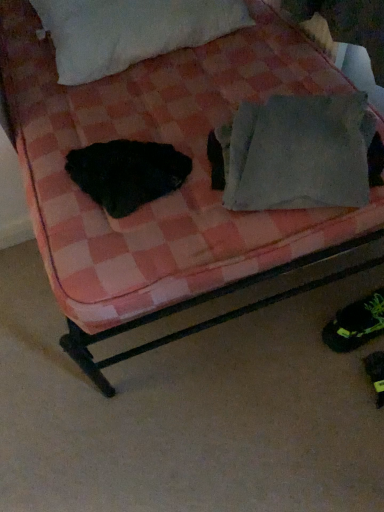
The width and height of the screenshot is (384, 512). What do you see at coordinates (130, 31) in the screenshot?
I see `white fluffy pillow at upper center, the second pillow when ordered from front to back` at bounding box center [130, 31].

You are a GUI agent. You are given a task and a screenshot of the screen. Output one action in this format:
    pyautogui.click(x=<x>, y=<y>)
    Task: Click on the green synthetic shoe at lower right
    
    Given the screenshot: What is the action you would take?
    pyautogui.click(x=356, y=323)

From the image's perspective, is white fluffy pillow at upper center, marked as the second pillow in a right-to-left arrangement, above black fuzzy animal at left?

Yes.

Based on the photo, would you consider white fluffy pillow at upper center, marked as the second pillow in a right-to-left arrangement, to be distant from black fuzzy animal at left?

No, white fluffy pillow at upper center, marked as the second pillow in a right-to-left arrangement, is not far from black fuzzy animal at left.

Which of these two, white fluffy pillow at upper center, marked as the second pillow in a right-to-left arrangement, or black fuzzy animal at left, is thinner?

black fuzzy animal at left.

In the scene shown: Is black fuzzy animal at left positioned with its back to gray fabric pillow at upper right, marked as the 2th pillow in a left-to-right arrangement?

No.

How many degrees apart are the facing directions of black fuzzy animal at left and gray fabric pillow at upper right, the 1th pillow viewed from the right?

They differ by 24.9 degrees in their facing directions.

Based on the photo, which of these two, black fuzzy animal at left or gray fabric pillow at upper right, which appears as the first pillow when ordered from the bottom, is bigger?

gray fabric pillow at upper right, which appears as the first pillow when ordered from the bottom, is bigger.

From the image's perspective, which one is positioned higher, black fuzzy animal at left or gray fabric pillow at upper right, the second pillow positioned from the top?

gray fabric pillow at upper right, the second pillow positioned from the top, appears higher in the image.

Does black fuzzy animal at left have a lesser height compared to green synthetic shoe at lower right?

Correct, black fuzzy animal at left is not as tall as green synthetic shoe at lower right.

Which object is closer to the camera, black fuzzy animal at left or green synthetic shoe at lower right?

black fuzzy animal at left is closer to the camera.

How different are the orientations of black fuzzy animal at left and green synthetic shoe at lower right in degrees?

87.3 degrees separate the facing orientations of black fuzzy animal at left and green synthetic shoe at lower right.

How much distance is there between black fuzzy animal at left and green synthetic shoe at lower right?

A distance of 27.29 inches exists between black fuzzy animal at left and green synthetic shoe at lower right.

The image size is (384, 512). Identify the location of pillow on the left of gray fabric pillow at upper right, acting as the second pillow starting from the back. (130, 31).

Consider the image. Which point is more forward, (144, 19) or (340, 96)?

Point (340, 96)

Which is in front, white fluffy pillow at upper center, positioned as the 1th pillow in left-to-right order, or gray fabric pillow at upper right, the 1th pillow viewed from the right?

gray fabric pillow at upper right, the 1th pillow viewed from the right, is in front.

Is white fluffy pillow at upper center, positioned as the 1th pillow in left-to-right order, positioned far away from green synthetic shoe at lower right?

white fluffy pillow at upper center, positioned as the 1th pillow in left-to-right order, is positioned a significant distance from green synthetic shoe at lower right.

Considering the relative positions of white fluffy pillow at upper center, marked as the second pillow in a right-to-left arrangement, and green synthetic shoe at lower right in the image provided, is white fluffy pillow at upper center, marked as the second pillow in a right-to-left arrangement, to the right of green synthetic shoe at lower right from the viewer's perspective?

No, white fluffy pillow at upper center, marked as the second pillow in a right-to-left arrangement, is not to the right of green synthetic shoe at lower right.

Considering the sizes of white fluffy pillow at upper center, positioned as the 1th pillow in left-to-right order, and green synthetic shoe at lower right in the image, is white fluffy pillow at upper center, positioned as the 1th pillow in left-to-right order, wider or thinner than green synthetic shoe at lower right?

In the image, white fluffy pillow at upper center, positioned as the 1th pillow in left-to-right order, appears to be wider than green synthetic shoe at lower right.

Measure the distance from white fluffy pillow at upper center, which ranks as the first pillow in back-to-front order, to green synthetic shoe at lower right.

1.03 meters.

Does gray fabric pillow at upper right, the first pillow when ordered from front to back, have a smaller size compared to white fluffy pillow at upper center, positioned as the 1th pillow in left-to-right order?

Yes.

Is gray fabric pillow at upper right, acting as the second pillow starting from the back, beside white fluffy pillow at upper center, positioned as the 1th pillow in left-to-right order?

No, gray fabric pillow at upper right, acting as the second pillow starting from the back, is not with white fluffy pillow at upper center, positioned as the 1th pillow in left-to-right order.

Does gray fabric pillow at upper right, acting as the second pillow starting from the back, turn towards white fluffy pillow at upper center, positioned as the 1th pillow in left-to-right order?

No, gray fabric pillow at upper right, acting as the second pillow starting from the back, does not turn towards white fluffy pillow at upper center, positioned as the 1th pillow in left-to-right order.

From a real-world perspective, which is physically below, gray fabric pillow at upper right, acting as the second pillow starting from the back, or white fluffy pillow at upper center, the 1th pillow in the top-to-bottom sequence?

In real-world perspective, gray fabric pillow at upper right, acting as the second pillow starting from the back, is lower.

Considering the sizes of gray fabric pillow at upper right, which appears as the first pillow when ordered from the bottom, and green synthetic shoe at lower right in the image, is gray fabric pillow at upper right, which appears as the first pillow when ordered from the bottom, wider or thinner than green synthetic shoe at lower right?

Considering their sizes, gray fabric pillow at upper right, which appears as the first pillow when ordered from the bottom, looks broader than green synthetic shoe at lower right.

Can you confirm if gray fabric pillow at upper right, acting as the second pillow starting from the back, is shorter than green synthetic shoe at lower right?

No.

Consider the image. Is gray fabric pillow at upper right, acting as the second pillow starting from the back, placed right next to green synthetic shoe at lower right?

gray fabric pillow at upper right, acting as the second pillow starting from the back, is not next to green synthetic shoe at lower right, and they're not touching.

Consider the image. From the image's perspective, is gray fabric pillow at upper right, acting as the second pillow starting from the back, under green synthetic shoe at lower right?

Actually, gray fabric pillow at upper right, acting as the second pillow starting from the back, appears above green synthetic shoe at lower right in the image.

At what (x,y) coordinates should I click in order to perform the action: click on animal in front of the white fluffy pillow at upper center, which ranks as the first pillow in back-to-front order. Please return your answer as a coordinate pair (x, y). Looking at the image, I should click on (127, 173).

This screenshot has width=384, height=512. I want to click on animal on the left of gray fabric pillow at upper right, the second pillow positioned from the top, so click(127, 173).

Looking at the image, which one is located further to black fuzzy animal at left, green synthetic shoe at lower right or gray fabric pillow at upper right, the first pillow when ordered from front to back?

green synthetic shoe at lower right.

Looking at the image, which one is located closer to green synthetic shoe at lower right, black fuzzy animal at left or white fluffy pillow at upper center, the 1th pillow in the top-to-bottom sequence?

Based on the image, black fuzzy animal at left appears to be nearer to green synthetic shoe at lower right.

When comparing their distances from gray fabric pillow at upper right, the first pillow when ordered from front to back, does black fuzzy animal at left or white fluffy pillow at upper center, the 2th pillow from the bottom, seem closer?

black fuzzy animal at left is closer to gray fabric pillow at upper right, the first pillow when ordered from front to back.

Which object lies nearer to the anchor point black fuzzy animal at left, gray fabric pillow at upper right, the second pillow positioned from the top, or green synthetic shoe at lower right?

gray fabric pillow at upper right, the second pillow positioned from the top, is positioned closer to the anchor black fuzzy animal at left.

Considering their positions, is black fuzzy animal at left positioned further to gray fabric pillow at upper right, which appears as the first pillow when ordered from the bottom, than green synthetic shoe at lower right?

Based on the image, green synthetic shoe at lower right appears to be further to gray fabric pillow at upper right, which appears as the first pillow when ordered from the bottom.

Looking at the image, which one is located closer to gray fabric pillow at upper right, marked as the 2th pillow in a left-to-right arrangement, green synthetic shoe at lower right or black fuzzy animal at left?

Based on the image, black fuzzy animal at left appears to be nearer to gray fabric pillow at upper right, marked as the 2th pillow in a left-to-right arrangement.

Looking at the image, which one is located further to white fluffy pillow at upper center, the 2th pillow from the bottom, black fuzzy animal at left or gray fabric pillow at upper right, marked as the 2th pillow in a left-to-right arrangement?

gray fabric pillow at upper right, marked as the 2th pillow in a left-to-right arrangement, lies further to white fluffy pillow at upper center, the 2th pillow from the bottom, than the other object.

From the image, which object appears to be farther from green synthetic shoe at lower right, white fluffy pillow at upper center, positioned as the 1th pillow in left-to-right order, or gray fabric pillow at upper right, marked as the 2th pillow in a left-to-right arrangement?

The object further to green synthetic shoe at lower right is white fluffy pillow at upper center, positioned as the 1th pillow in left-to-right order.

At what (x,y) coordinates should I click in order to perform the action: click on pillow between white fluffy pillow at upper center, the 2th pillow from the bottom, and green synthetic shoe at lower right, in the vertical direction. Please return your answer as a coordinate pair (x, y). The width and height of the screenshot is (384, 512). Looking at the image, I should click on (298, 153).

Identify the location of animal between white fluffy pillow at upper center, which ranks as the first pillow in back-to-front order, and green synthetic shoe at lower right, in the vertical direction. The image size is (384, 512). (127, 173).

At what (x,y) coordinates should I click in order to perform the action: click on pillow between black fuzzy animal at left and green synthetic shoe at lower right in the horizontal direction. Please return your answer as a coordinate pair (x, y). This screenshot has width=384, height=512. Looking at the image, I should click on (298, 153).

Locate an element on the screen. The image size is (384, 512). pillow between white fluffy pillow at upper center, positioned as the 1th pillow in left-to-right order, and black fuzzy animal at left vertically is located at coordinates (298, 153).